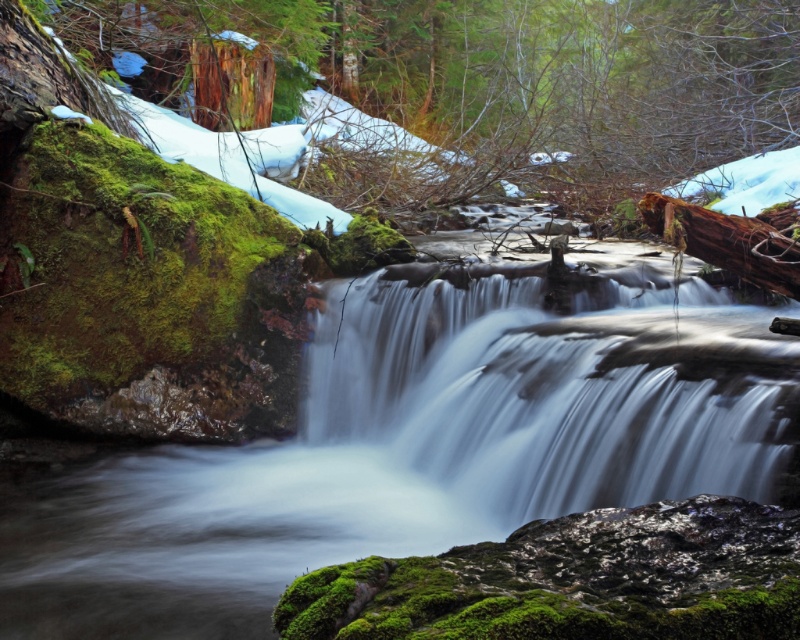
Can you confirm if white smooth waterfall at center is smaller than brown rough log at upper center?

No.

Is point (400, 339) closer to camera compared to point (652, 228)?

That is False.

Image resolution: width=800 pixels, height=640 pixels. I want to click on white smooth waterfall at center, so click(x=528, y=403).

Between green mossy rock at upper left and white smooth waterfall at center, which one is positioned lower?

white smooth waterfall at center is lower down.

This screenshot has width=800, height=640. What are the coordinates of `green mossy rock at upper left` in the screenshot? It's located at (488, 84).

Can you confirm if green mossy rock at center is thinner than green mossy rock at upper left?

Yes, green mossy rock at center is thinner than green mossy rock at upper left.

Is green mossy rock at center shorter than green mossy rock at upper left?

Indeed, green mossy rock at center has a lesser height compared to green mossy rock at upper left.

Which is behind, point (684, 468) or point (446, 166)?

The point (446, 166) is more distant.

Where is `green mossy rock at center`? green mossy rock at center is located at coordinates (386, 461).